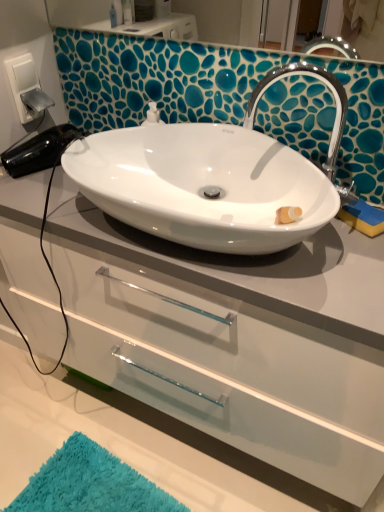
Question: Is silver metallic switch at upper left outside chrome metallic faucet at upper right?

Choices:
 (A) yes
 (B) no

Answer: (A)

Question: Is silver metallic switch at upper left placed right next to chrome metallic faucet at upper right?

Choices:
 (A) yes
 (B) no

Answer: (B)

Question: Can you confirm if silver metallic switch at upper left is taller than chrome metallic faucet at upper right?

Choices:
 (A) yes
 (B) no

Answer: (B)

Question: Is silver metallic switch at upper left turned away from chrome metallic faucet at upper right?

Choices:
 (A) yes
 (B) no

Answer: (B)

Question: From a real-world perspective, is silver metallic switch at upper left under chrome metallic faucet at upper right?

Choices:
 (A) yes
 (B) no

Answer: (B)

Question: From the image's perspective, is silver metallic switch at upper left located beneath chrome metallic faucet at upper right?

Choices:
 (A) yes
 (B) no

Answer: (B)

Question: Is white glossy sink at center wider than turquoise shaggy bath mat at lower left?

Choices:
 (A) yes
 (B) no

Answer: (B)

Question: Does white glossy sink at center appear on the left side of turquoise shaggy bath mat at lower left?

Choices:
 (A) yes
 (B) no

Answer: (B)

Question: Is white glossy sink at center at the right side of turquoise shaggy bath mat at lower left?

Choices:
 (A) no
 (B) yes

Answer: (B)

Question: From a real-world perspective, does white glossy sink at center sit lower than turquoise shaggy bath mat at lower left?

Choices:
 (A) yes
 (B) no

Answer: (B)

Question: From the image's perspective, is white glossy sink at center below turquoise shaggy bath mat at lower left?

Choices:
 (A) yes
 (B) no

Answer: (B)

Question: Could turquoise shaggy bath mat at lower left be considered to be inside white glossy sink at center?

Choices:
 (A) yes
 (B) no

Answer: (B)

Question: Are chrome metallic faucet at upper right and white glossy sink at center making contact?

Choices:
 (A) no
 (B) yes

Answer: (A)